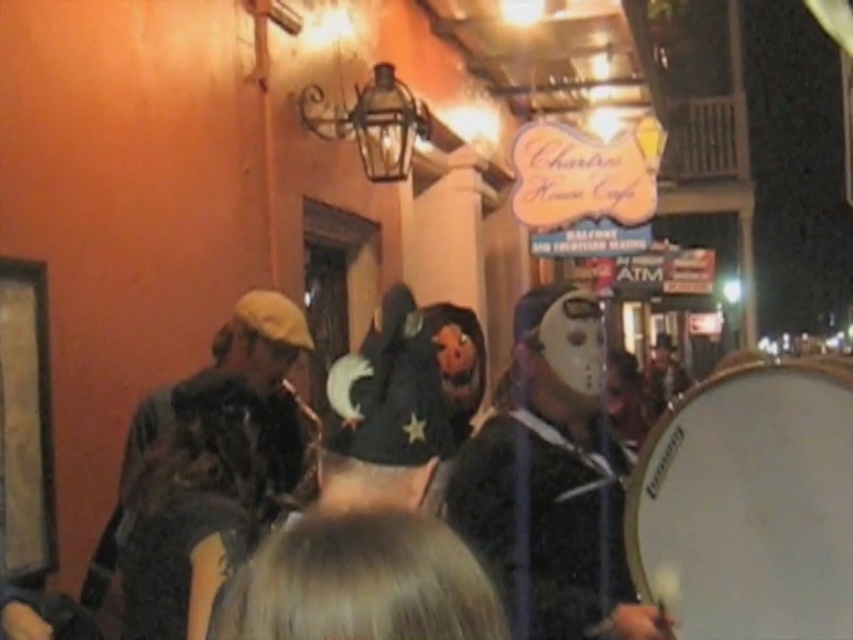
Question: Is white drum at right thinner than matte black drum at right?

Choices:
 (A) no
 (B) yes

Answer: (B)

Question: Does dark brown leather jacket at left appear on the right side of matte black drum at right?

Choices:
 (A) no
 (B) yes

Answer: (A)

Question: Estimate the real-world distances between objects in this image. Which object is closer to the matte black drum at right?

Choices:
 (A) dark brown leather jacket at left
 (B) white drum at right

Answer: (B)

Question: Does white drum at right appear over dark brown leather jacket at left?

Choices:
 (A) no
 (B) yes

Answer: (A)

Question: Which point is closer to the camera taking this photo?

Choices:
 (A) (846, 385)
 (B) (111, 605)

Answer: (A)

Question: Which object appears farthest from the camera in this image?

Choices:
 (A) white drum at right
 (B) matte black drum at right
 (C) dark brown leather jacket at left

Answer: (B)